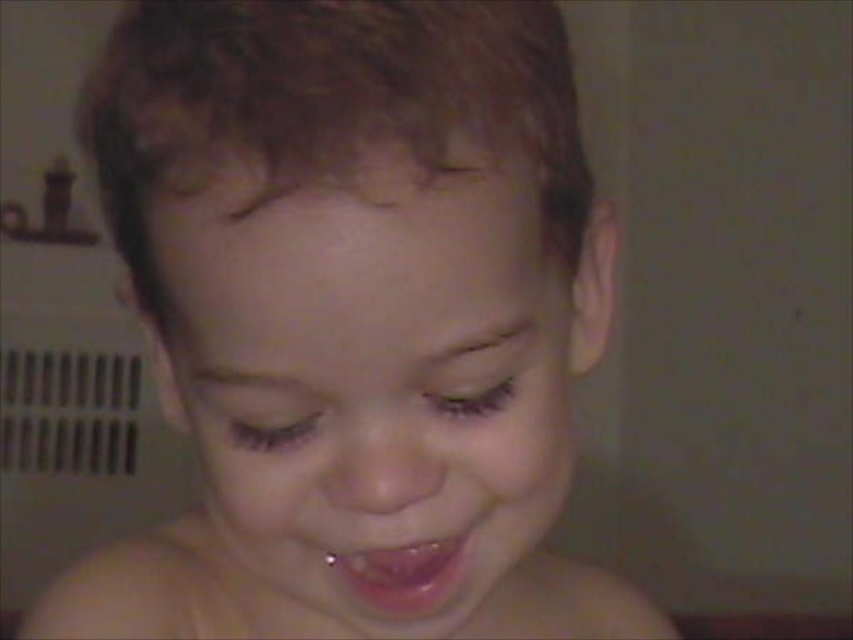
Question: Does pink glossy lips at center have a lesser width compared to metallic gold toy at upper left?

Choices:
 (A) no
 (B) yes

Answer: (B)

Question: Can you confirm if pink glossy lips at center is positioned to the left of metallic gold toy at upper left?

Choices:
 (A) no
 (B) yes

Answer: (A)

Question: Does pink glossy lips at center appear under metallic gold toy at upper left?

Choices:
 (A) yes
 (B) no

Answer: (A)